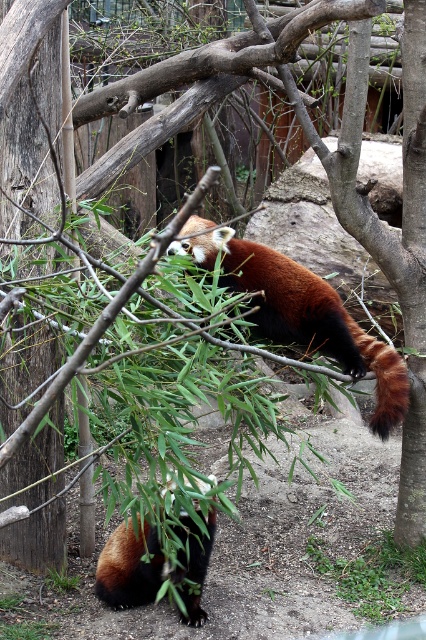
Between point (247, 275) and point (198, 604), which one is positioned behind?

Point (198, 604)

Does fluffy reddish-brown red panda at center appear under fluffy reddish-brown panda at lower center?

Incorrect, fluffy reddish-brown red panda at center is not positioned below fluffy reddish-brown panda at lower center.

Which is behind, point (377, 396) or point (209, 520)?

Positioned behind is point (377, 396).

What are the coordinates of `fluffy reddish-brown red panda at center` in the screenshot? It's located at (301, 310).